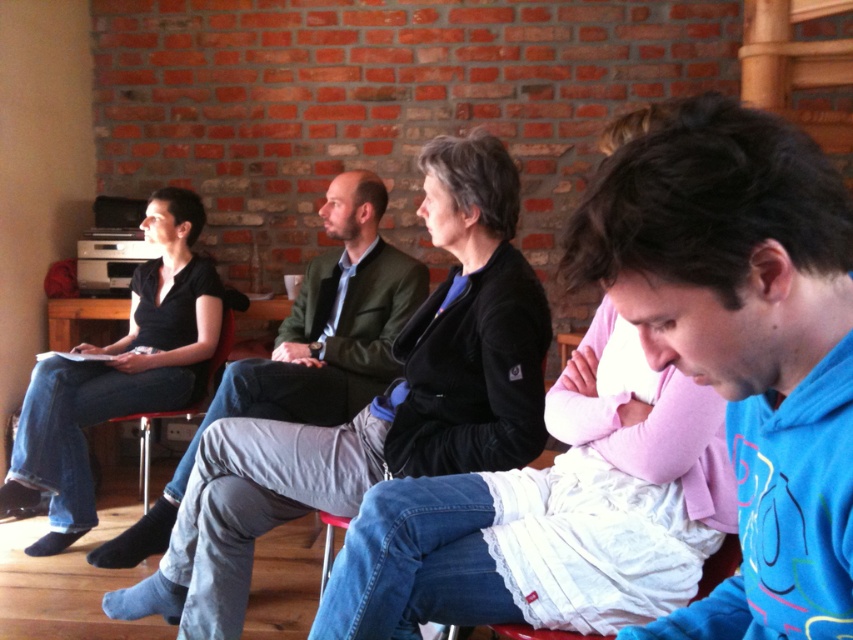
Question: Is blue fleece jacket at center to the right of matte green jacket at center from the viewer's perspective?

Choices:
 (A) no
 (B) yes

Answer: (B)

Question: Is blue fleece jacket at center positioned in front of matte green jacket at center?

Choices:
 (A) no
 (B) yes

Answer: (B)

Question: Is the position of blue fleece jacket at center more distant than that of black sweater at center?

Choices:
 (A) no
 (B) yes

Answer: (A)

Question: Which point appears closest to the camera in this image?

Choices:
 (A) (143, 417)
 (B) (694, 452)

Answer: (B)

Question: Which object appears closest to the camera in this image?

Choices:
 (A) black sweater at center
 (B) matte green jacket at center

Answer: (A)

Question: Among these points, which one is nearest to the camera?

Choices:
 (A) (711, 499)
 (B) (804, 452)
 (C) (142, 490)

Answer: (B)